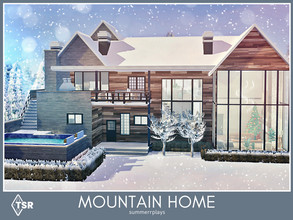
Locate an element on the screen. Image resolution: width=293 pixels, height=220 pixels. door is located at coordinates (109, 132).